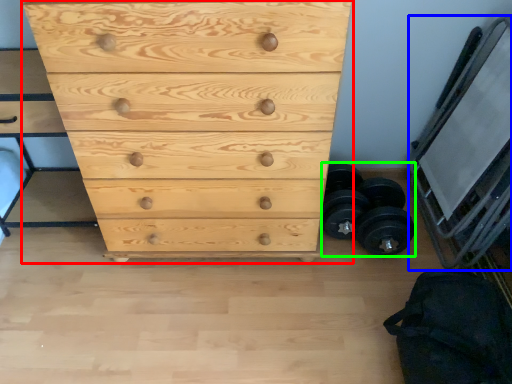
Question: Considering the real-world distances, which object is farthest from chest of drawers (highlighted by a red box)? bunk bed (highlighted by a blue box) or dumbbell (highlighted by a green box)?

Choices:
 (A) bunk bed
 (B) dumbbell

Answer: (A)